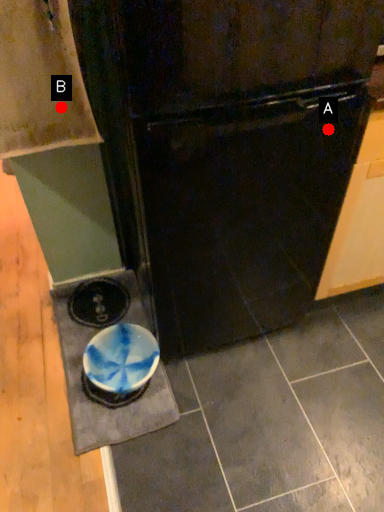
Question: Two points are circled on the image, labeled by A and B beside each circle. Which point appears closest to the camera in this image?

Choices:
 (A) A is closer
 (B) B is closer

Answer: (A)